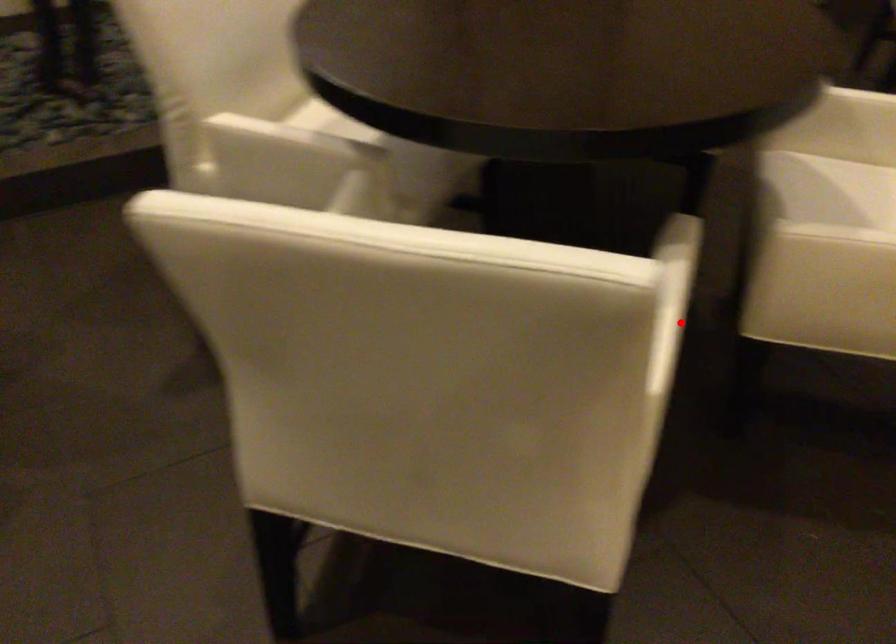
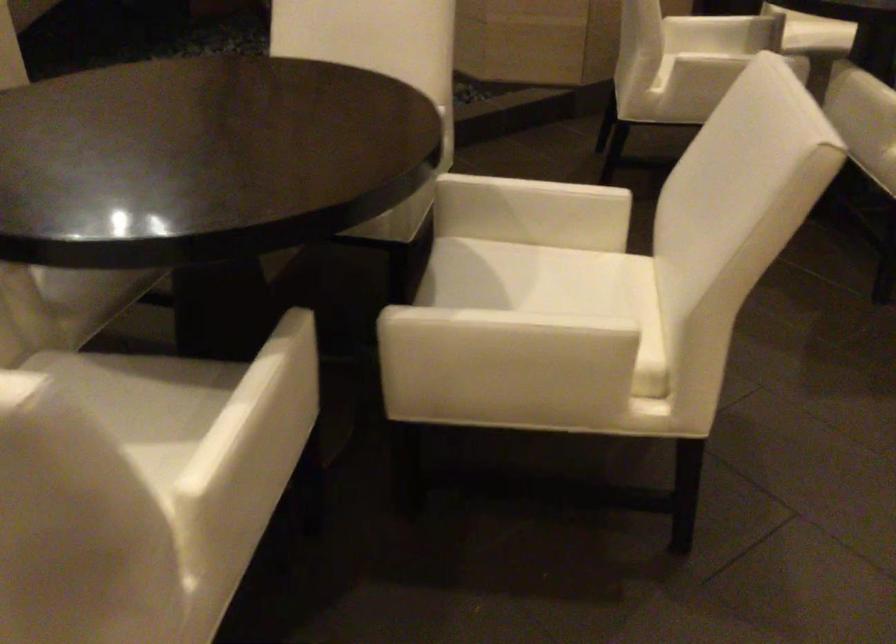
Question: I am providing you with two images of the same scene from different viewpoints. A red point is shown in image1. For the corresponding object point in image2, is it positioned nearer or farther from the camera?

Choices:
 (A) Nearer
 (B) Farther

Answer: (B)